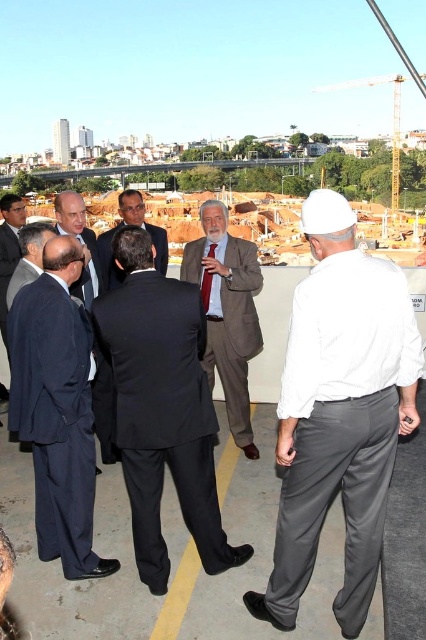
Question: Which of these objects is positioned farthest from the dark suit at center?

Choices:
 (A) dark gray suit at center
 (B) red silk tie at center
 (C) dark blue suit at center
 (D) dark blue suit at left

Answer: (A)

Question: Is dark gray suit at center below dark suit at center?

Choices:
 (A) no
 (B) yes

Answer: (B)

Question: Can you confirm if dark blue suit at left is positioned below matte black suit at left?

Choices:
 (A) no
 (B) yes

Answer: (B)

Question: Does dark suit at center have a greater width compared to red silk tie at center?

Choices:
 (A) yes
 (B) no

Answer: (A)

Question: Which object is positioned farthest from the dark gray suit at center?

Choices:
 (A) white matte hard hat at center
 (B) dark blue suit at left
 (C) red silk tie at center
 (D) matte brown suit at center

Answer: (C)

Question: Which point is farther to the camera?

Choices:
 (A) dark blue suit at center
 (B) dark gray suit at center
 (C) dark suit at center
 (D) matte brown suit at center

Answer: (C)